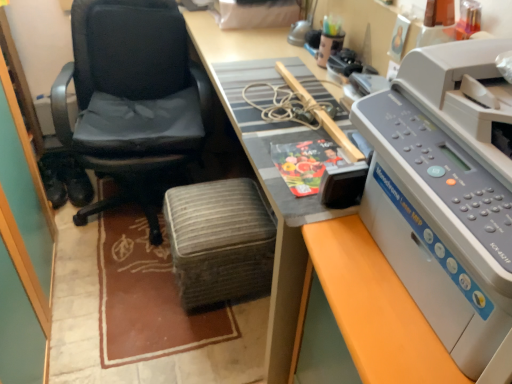
Image resolution: width=512 pixels, height=384 pixels. I want to click on vacant area that is in front of black leather chair at left, so click(123, 306).